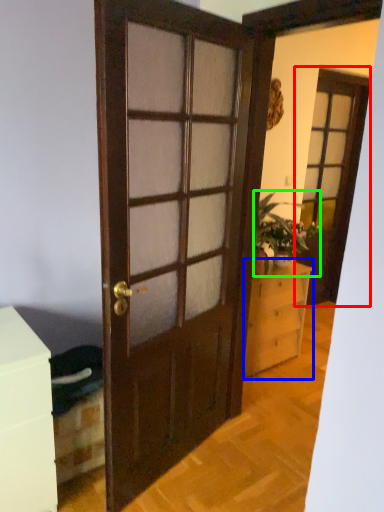
Question: Estimate the real-world distances between objects in this image. Which object is farther from screen door (highlighted by a red box), chest of drawers (highlighted by a blue box) or houseplant (highlighted by a green box)?

Choices:
 (A) chest of drawers
 (B) houseplant

Answer: (A)